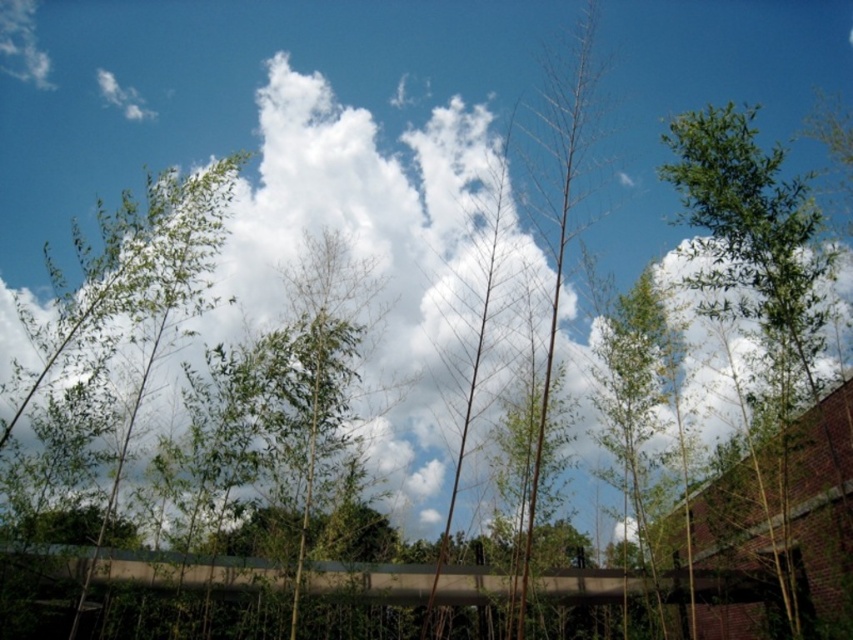
You are planning to install a new garden bench in the middle of the area between the green leafy tree at left and the green leafy tree at upper right. The bench requires a minimum of 20 feet of space between the two trees to be placed comfortably. Based on the distance provided, can the bench be placed there?

Result: The green leafy tree at left is 26.55 feet from the green leafy tree at upper right. Since the required minimum distance is 20 feet, the bench can be placed there comfortably as the distance exceeds the requirement.

You are standing in the outdoor scene with the bamboo plants and the brick structure. There is a point marked at coordinates [138,289]. What object is located at this point?

The point at coordinates [138,289] marks the green leafy tree at left.

You are standing in the bamboo grove and looking at the white fluffy cloud at upper center and the green leafy tree at upper right. Which object is closer to your eyes?

The white fluffy cloud at upper center is closer to your eyes because it is positioned further to the viewer than the green leafy tree at upper right.